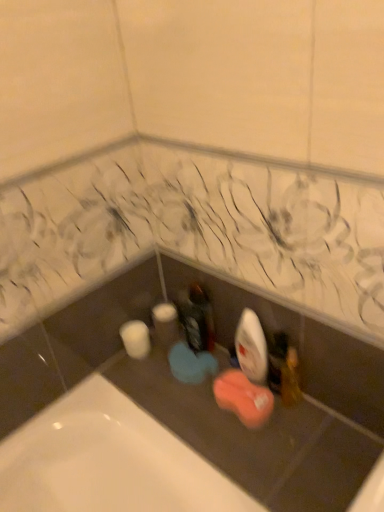
Question: From the image's perspective, is white matte toilet paper at lower left under wooden toothbrush at lower right?

Choices:
 (A) yes
 (B) no

Answer: (B)

Question: Is white matte toilet paper at lower left at the left side of wooden toothbrush at lower right?

Choices:
 (A) no
 (B) yes

Answer: (B)

Question: Are white matte toilet paper at lower left and wooden toothbrush at lower right making contact?

Choices:
 (A) no
 (B) yes

Answer: (A)

Question: Does white matte toilet paper at lower left have a smaller size compared to wooden toothbrush at lower right?

Choices:
 (A) yes
 (B) no

Answer: (B)

Question: Is wooden toothbrush at lower right located within white matte toilet paper at lower left?

Choices:
 (A) yes
 (B) no

Answer: (B)

Question: From the image's perspective, is wooden toothbrush at lower right positioned above or below white matte toilet paper at lower left?

Choices:
 (A) below
 (B) above

Answer: (A)

Question: From a real-world perspective, is wooden toothbrush at lower right physically located above or below white matte toilet paper at lower left?

Choices:
 (A) below
 (B) above

Answer: (B)

Question: In the image, is wooden toothbrush at lower right positioned in front of or behind white matte toilet paper at lower left?

Choices:
 (A) behind
 (B) front

Answer: (B)

Question: Is wooden toothbrush at lower right bigger or smaller than white matte toilet paper at lower left?

Choices:
 (A) big
 (B) small

Answer: (B)

Question: Considering their positions, is white matte toilet paper at lower left located in front of or behind matte black bottle at center?

Choices:
 (A) front
 (B) behind

Answer: (B)

Question: In terms of height, does white matte toilet paper at lower left look taller or shorter compared to matte black bottle at center?

Choices:
 (A) tall
 (B) short

Answer: (B)

Question: From a real-world perspective, is white matte toilet paper at lower left above or below matte black bottle at center?

Choices:
 (A) below
 (B) above

Answer: (A)

Question: From the image's perspective, relative to matte black bottle at center, is white matte toilet paper at lower left above or below?

Choices:
 (A) below
 (B) above

Answer: (A)

Question: Is matte black bottle at center in front of or behind wooden toothbrush at lower right in the image?

Choices:
 (A) front
 (B) behind

Answer: (B)

Question: From their relative heights in the image, would you say matte black bottle at center is taller or shorter than wooden toothbrush at lower right?

Choices:
 (A) tall
 (B) short

Answer: (B)